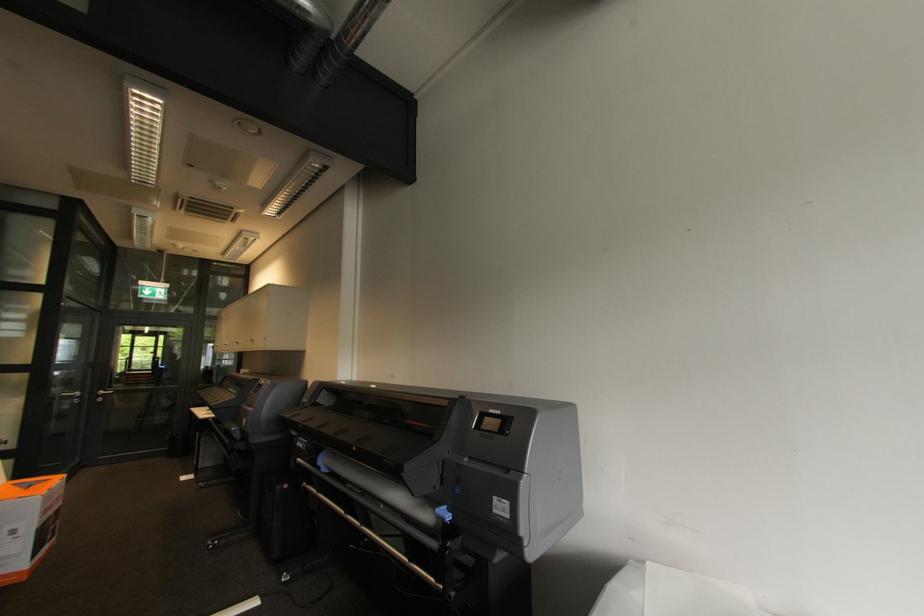
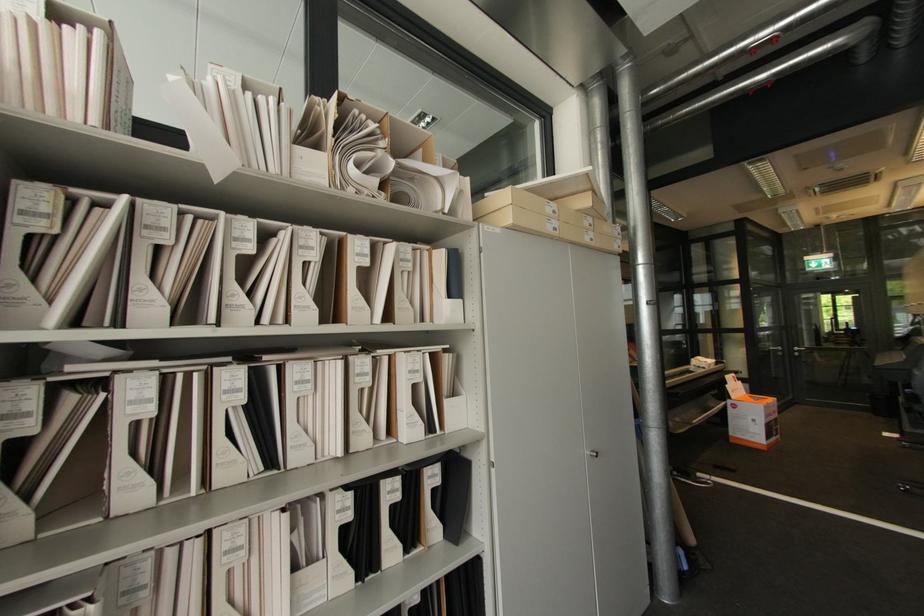
Where in the second image is the point corresponding to point 103,400 from the first image?

(800, 354)